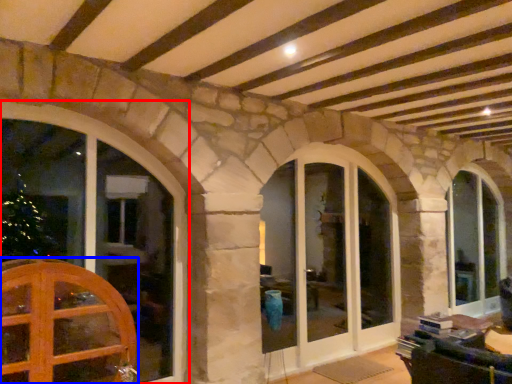
Question: Which point is further to the camera, window (highlighted by a red box) or door (highlighted by a blue box)?

Choices:
 (A) window
 (B) door

Answer: (A)